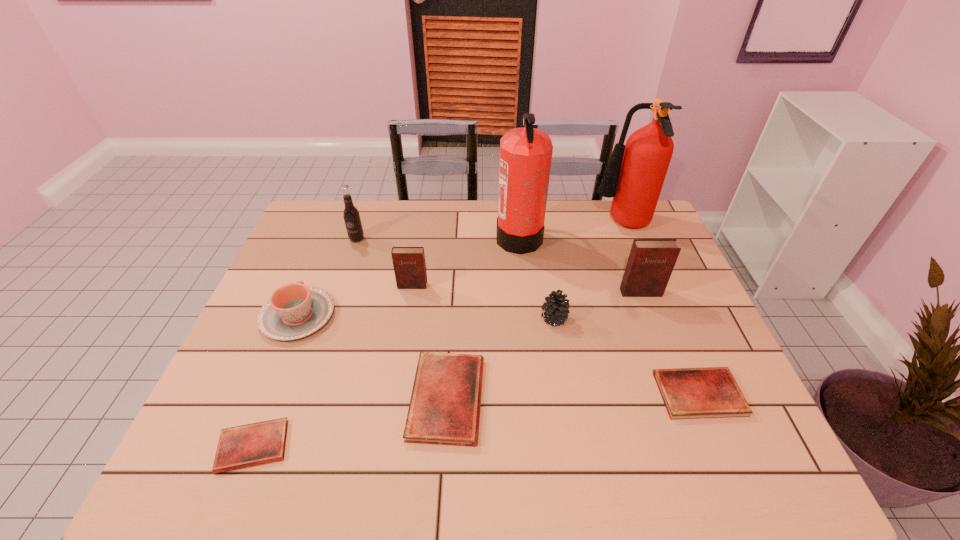
Locate an element on the screen. black fire extinguisher is located at coordinates (525, 153).

You are a GUI agent. You are given a task and a screenshot of the screen. Output one action in this format:
    pyautogui.click(x=<x>, y=<y>)
    Task: Click on the red fire extinguisher
    The image size is (960, 540).
    Given the screenshot: What is the action you would take?
    pyautogui.click(x=634, y=176)

The image size is (960, 540). In order to click on root beer in this screenshot , I will do `click(352, 220)`.

Identify the location of the right reddish-brown diary. Image resolution: width=960 pixels, height=540 pixels. (650, 264).

The height and width of the screenshot is (540, 960). Identify the location of the tallest diary. (650, 264).

At what (x,y) coordinates should I click in order to perform the action: click on the second tallest diary. Please return your answer as a coordinate pair (x, y). Image resolution: width=960 pixels, height=540 pixels. Looking at the image, I should click on (409, 265).

You are a GUI agent. You are given a task and a screenshot of the screen. Output one action in this format:
    pyautogui.click(x=<x>, y=<y>)
    Task: Click on the smaller reddish-brown diary
    This screenshot has width=960, height=540.
    Given the screenshot: What is the action you would take?
    pyautogui.click(x=409, y=265)

At what (x,y) coordinates should I click in order to perform the action: click on pinecone. Please return your answer as a coordinate pair (x, y). The image size is (960, 540). Looking at the image, I should click on (556, 307).

You are a GUI agent. You are given a task and a screenshot of the screen. Output one action in this format:
    pyautogui.click(x=<x>, y=<y>)
    Task: Click on the sixth tallest object
    
    Given the screenshot: What is the action you would take?
    pyautogui.click(x=556, y=307)

At what (x,y) coordinates should I click in order to perform the action: click on chinaware. Please return your answer as a coordinate pair (x, y). The height and width of the screenshot is (540, 960). Looking at the image, I should click on (294, 311).